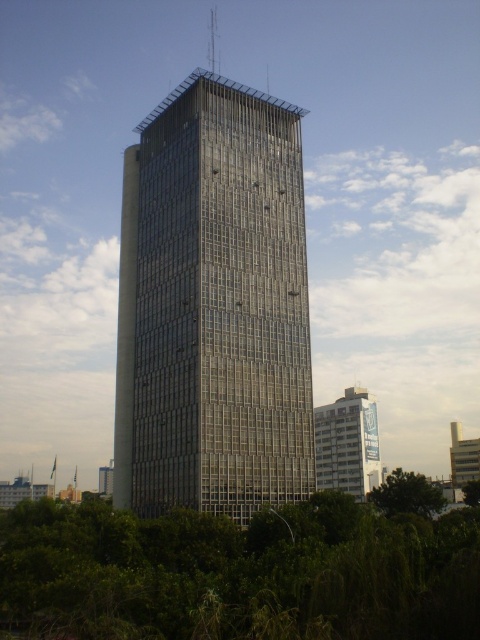
Is point (94, 580) closer to viewer compared to point (343, 410)?

Yes, point (94, 580) is closer to viewer.

Where is `green leafy tree at lower center`? green leafy tree at lower center is located at coordinates (239, 573).

Does point (284, 392) come closer to viewer compared to point (358, 388)?

That is True.

The height and width of the screenshot is (640, 480). What do you see at coordinates (214, 307) in the screenshot?
I see `transparent glass tower at center` at bounding box center [214, 307].

Which is in front, point (178, 326) or point (330, 417)?

Point (178, 326) is in front.

Identify the location of transparent glass tower at center. The height and width of the screenshot is (640, 480). (214, 307).

Can you confirm if transparent glass tower at center is positioned above green leafy tree at lower center?

Yes.

Is point (144, 337) closer to camera compared to point (96, 602)?

That is False.

The height and width of the screenshot is (640, 480). I want to click on transparent glass tower at center, so click(214, 307).